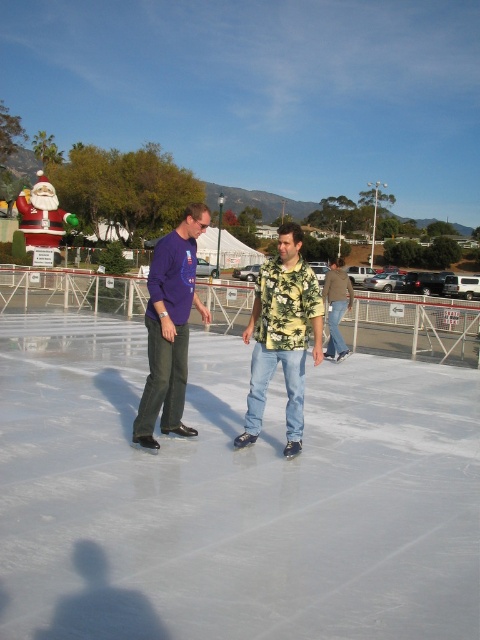
The height and width of the screenshot is (640, 480). Describe the element at coordinates (231, 496) in the screenshot. I see `white smooth ice at center` at that location.

Is white smooth ice at center thinner than matte purple shirt at center?

No, white smooth ice at center is not thinner than matte purple shirt at center.

The image size is (480, 640). What are the coordinates of `white smooth ice at center` in the screenshot? It's located at (231, 496).

Does point (290, 355) come in front of point (162, 312)?

No, (290, 355) is behind (162, 312).

Can you confirm if yellow-green floral shirt at center is thinner than matte purple shirt at center?

Incorrect, yellow-green floral shirt at center's width is not less than matte purple shirt at center's.

Which is in front, point (241, 433) or point (180, 252)?

Point (180, 252) is more forward.

In order to click on yellow-green floral shirt at center in this screenshot , I will do `click(282, 336)`.

Is white smooth ice at center wider than yellow-green floral shirt at center?

Correct, the width of white smooth ice at center exceeds that of yellow-green floral shirt at center.

Based on the photo, between white smooth ice at center and yellow-green floral shirt at center, which one is positioned lower?

white smooth ice at center is lower down.

This screenshot has width=480, height=640. What do you see at coordinates (231, 496) in the screenshot?
I see `white smooth ice at center` at bounding box center [231, 496].

Where is `white smooth ice at center`? This screenshot has height=640, width=480. white smooth ice at center is located at coordinates (231, 496).